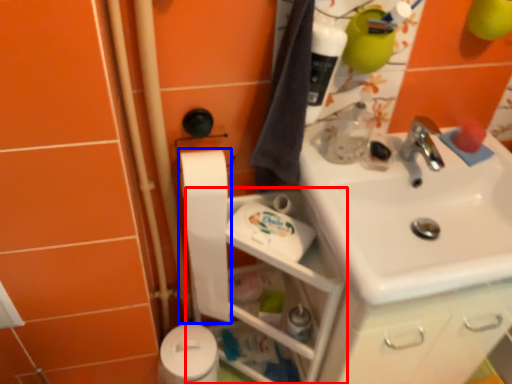
Question: Which object appears closest to the camera in this image, shelf (highlighted by a red box) or toilet paper (highlighted by a blue box)?

Choices:
 (A) shelf
 (B) toilet paper

Answer: (A)